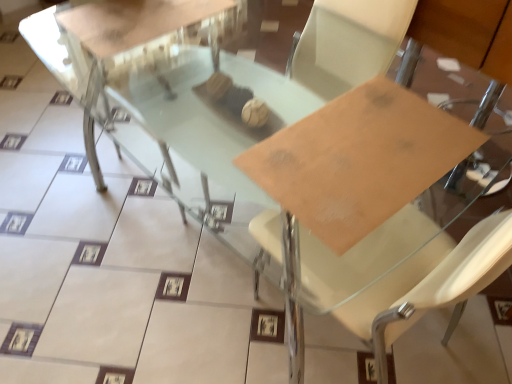
Question: Is point (345, 102) closer or farther from the camera than point (98, 54)?

Choices:
 (A) closer
 (B) farther

Answer: (A)

Question: From a real-world perspective, is matte cardboard at center physically located above or below clear glass table at center?

Choices:
 (A) above
 (B) below

Answer: (A)

Question: In the image, is matte cardboard at center on the left side or the right side of clear glass table at center?

Choices:
 (A) right
 (B) left

Answer: (A)

Question: In terms of height, does clear glass table at center look taller or shorter compared to matte cardboard at center?

Choices:
 (A) tall
 (B) short

Answer: (A)

Question: Relative to matte cardboard at center, is clear glass table at center in front or behind?

Choices:
 (A) front
 (B) behind

Answer: (B)

Question: Choose the correct answer: Is clear glass table at center inside matte cardboard at center or outside it?

Choices:
 (A) inside
 (B) outside

Answer: (B)

Question: Considering the positions of clear glass table at center and matte cardboard at center in the image, is clear glass table at center bigger or smaller than matte cardboard at center?

Choices:
 (A) small
 (B) big

Answer: (B)